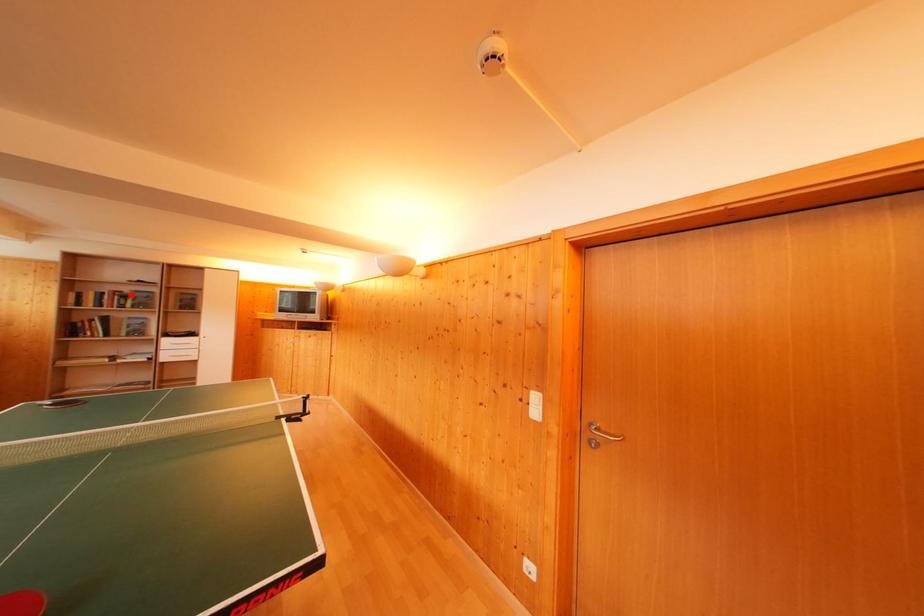
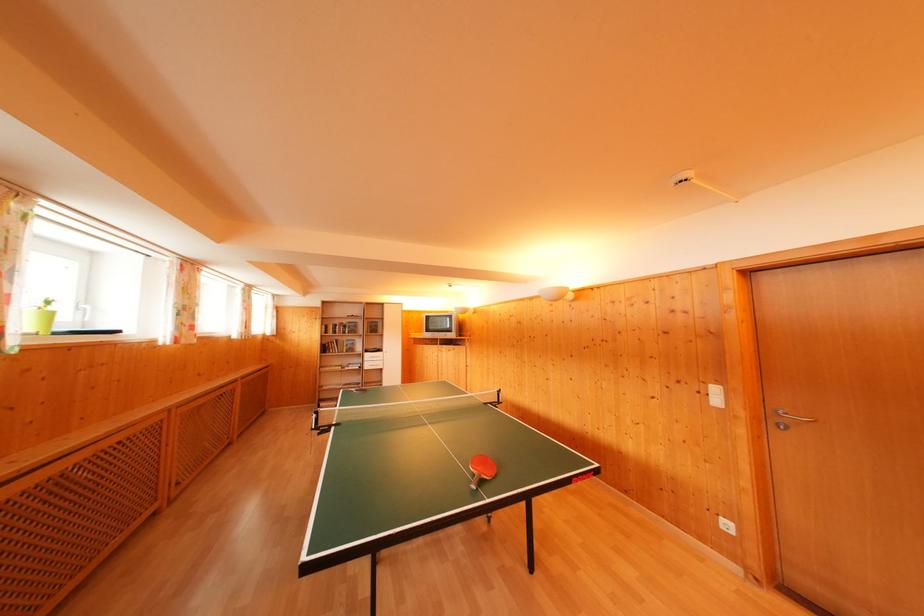
In the second image, find the point that corresponds to the highlighted location in the first image.

(349, 326)